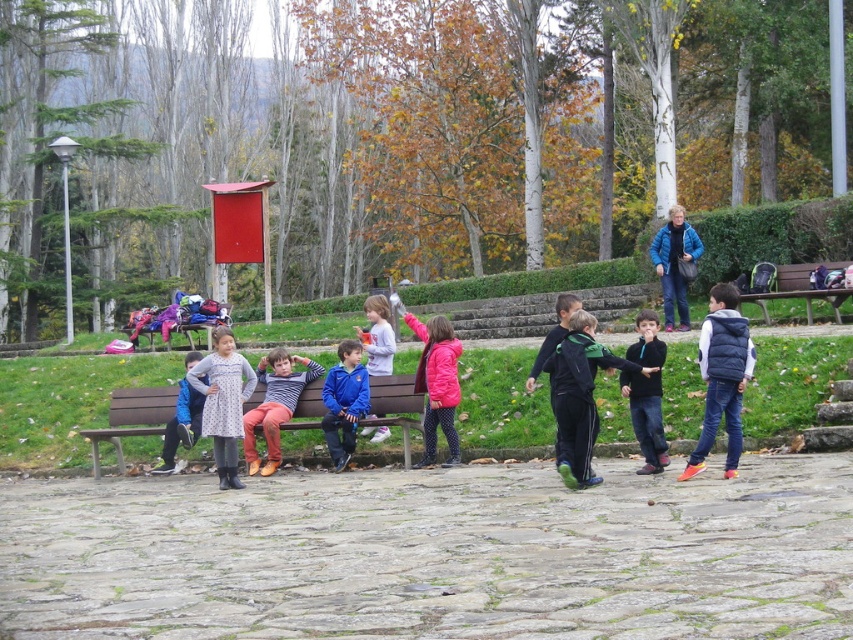
Does striped cotton shirt at center have a smaller size compared to blue fabric jacket at center?

Correct, striped cotton shirt at center occupies less space than blue fabric jacket at center.

In the scene shown: Which is more to the right, striped cotton shirt at center or blue fabric jacket at center?

From the viewer's perspective, striped cotton shirt at center appears more on the right side.

Where is `striped cotton shirt at center`? striped cotton shirt at center is located at coordinates (276, 404).

Which is behind, point (714, 99) or point (171, 465)?

The point (714, 99) is more distant.

Is wooden bench at center shorter than blue fabric jacket at center?

No, wooden bench at center is not shorter than blue fabric jacket at center.

Does point (650, 186) come in front of point (192, 413)?

No.

Identify the location of wooden bench at center. (407, 144).

Is point (227, 451) less distant than point (346, 404)?

Yes, it is.

Does patterned fabric dress at left appear under blue fleece jacket at center?

No, patterned fabric dress at left is not below blue fleece jacket at center.

Is point (213, 387) positioned in front of point (339, 452)?

Yes, it is.

I want to click on patterned fabric dress at left, so click(x=223, y=401).